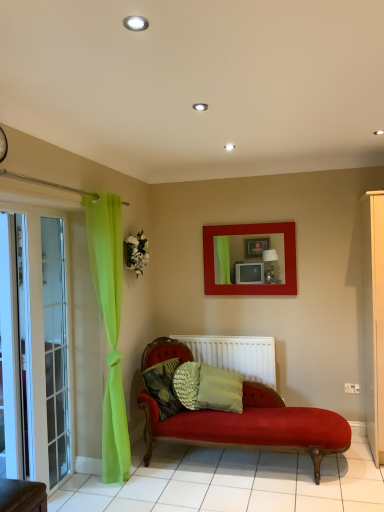
You are a GUI agent. You are given a task and a screenshot of the screen. Output one action in this format:
    pyautogui.click(x=<x>, y=<y>)
    Task: Click on the free space above matte red picture frame at center (from a real-world perspective)
    This screenshot has height=512, width=384.
    Given the screenshot: What is the action you would take?
    click(x=256, y=219)